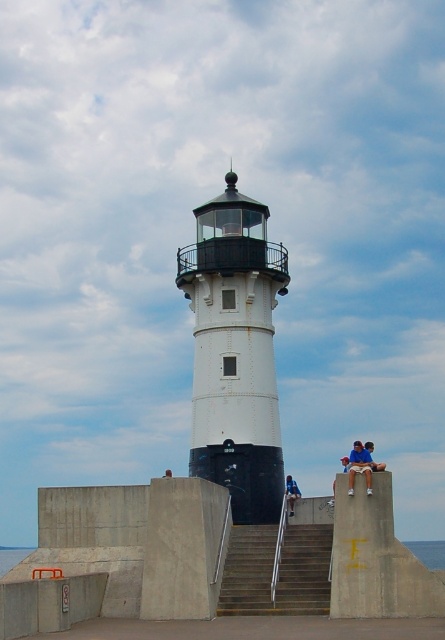
Question: Observing the image, what is the correct spatial positioning of concrete stairs at center in reference to blue denim jeans at lower center?

Choices:
 (A) right
 (B) left

Answer: (B)

Question: Can you confirm if blue cotton shirt at right is positioned below blue denim jeans at lower center?

Choices:
 (A) yes
 (B) no

Answer: (A)

Question: Estimate the real-world distances between objects in this image. Which object is closer to the blue cotton shirt at right?

Choices:
 (A) blue denim jeans at lower center
 (B) concrete stairs at center

Answer: (B)

Question: Which object appears farthest from the camera in this image?

Choices:
 (A) blue denim jeans at lower center
 (B) blue cotton shirt at right
 (C) white matte/lightweight tower at center
 (D) concrete stairs at center

Answer: (A)

Question: Which of the following is the closest to the observer?

Choices:
 (A) (351, 496)
 (B) (287, 488)
 (C) (307, 563)

Answer: (A)

Question: Is blue cotton shirt at right thinner than blue denim jeans at lower center?

Choices:
 (A) yes
 (B) no

Answer: (B)